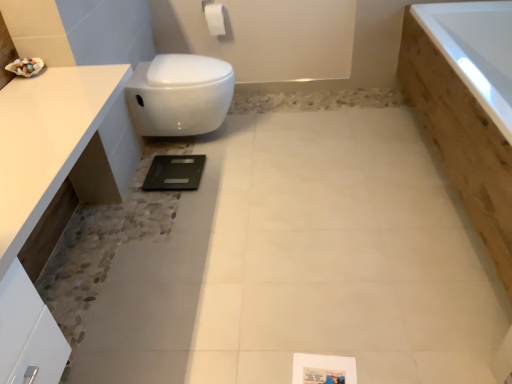
You are a GUI agent. You are given a task and a screenshot of the screen. Output one action in this format:
    pyautogui.click(x=<x>, y=<y>)
    Task: Click on the vacant area in front of white glossy toilet at upper left
    The height and width of the screenshot is (384, 512).
    Given the screenshot: What is the action you would take?
    pyautogui.click(x=220, y=179)